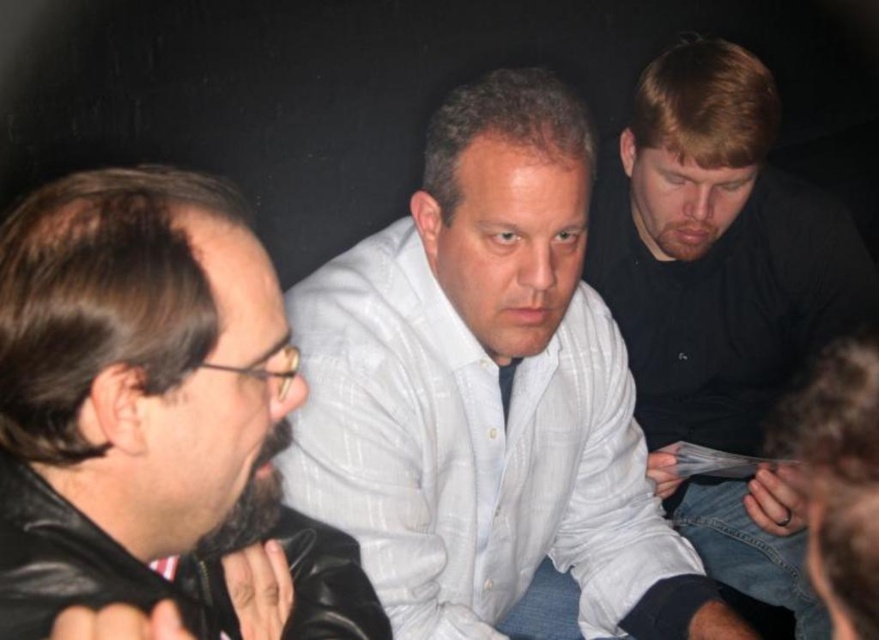
Question: Can you confirm if black leather jacket at left is positioned below black matte shirt at upper right?

Choices:
 (A) no
 (B) yes

Answer: (B)

Question: Which point is farther to the camera?

Choices:
 (A) (614, 428)
 (B) (680, 189)
 (C) (165, 256)

Answer: (B)

Question: Among these points, which one is nearest to the camera?

Choices:
 (A) 122,248
 (B) 379,500

Answer: (A)

Question: Which of the following is the farthest from the observer?

Choices:
 (A) (95, 276)
 (B) (425, 532)
 (C) (753, 412)

Answer: (C)

Question: Can you confirm if black leather jacket at left is positioned below black matte shirt at upper right?

Choices:
 (A) yes
 (B) no

Answer: (A)

Question: Is black leather jacket at left positioned behind black matte shirt at upper right?

Choices:
 (A) yes
 (B) no

Answer: (B)